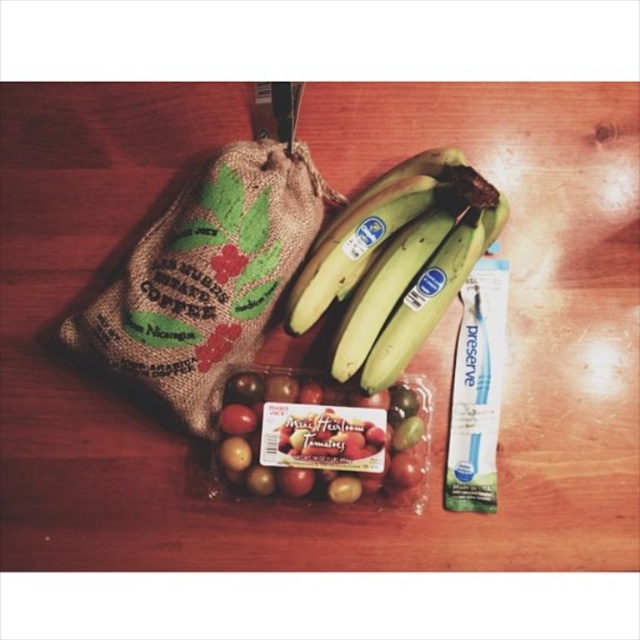
Looking at this image, is green matte bananas at center positioned in front of blue plastic toothpaste at center right?

Yes, it is.

Locate an element on the screen. green matte bananas at center is located at coordinates (396, 262).

The image size is (640, 640). I want to click on green matte bananas at center, so click(x=396, y=262).

Is point (401, 240) closer to camera compared to point (390, 460)?

Yes.

Is green matte bananas at center above shiny red tomatoes at center?

Yes.

Find the location of `green matte bananas at center`. green matte bananas at center is located at coordinates (396, 262).

Where is `green matte bananas at center`? The image size is (640, 640). green matte bananas at center is located at coordinates (396, 262).

Image resolution: width=640 pixels, height=640 pixels. Describe the element at coordinates (208, 276) in the screenshot. I see `burlap coffee bag at upper left` at that location.

Does burlap coffee bag at upper left appear over blue plastic toothpaste at center right?

Indeed, burlap coffee bag at upper left is positioned over blue plastic toothpaste at center right.

Identify the location of burlap coffee bag at upper left. (208, 276).